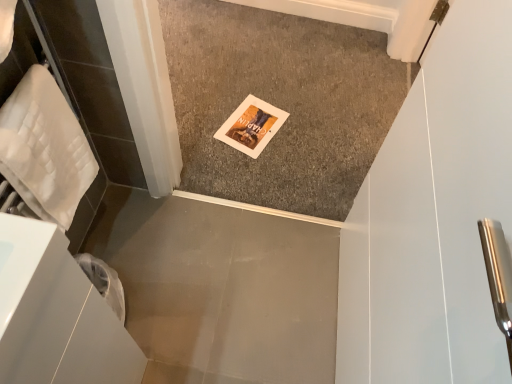
This screenshot has height=384, width=512. Find the location of `blank space situated above smooth gray concrete at lower left, which is the first concrete from front to back (from a real-world perspective)`. blank space situated above smooth gray concrete at lower left, which is the first concrete from front to back (from a real-world perspective) is located at coordinates (222, 284).